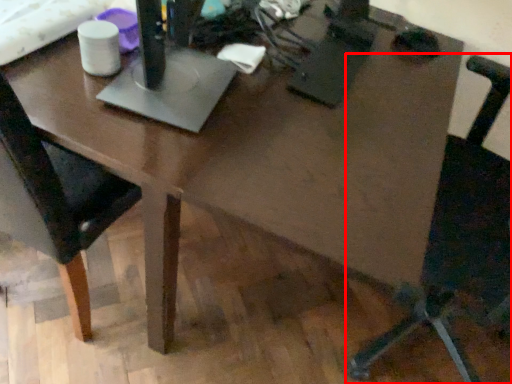
Question: Where is chair (annotated by the red box) located in relation to chair in the image?

Choices:
 (A) left
 (B) right

Answer: (B)